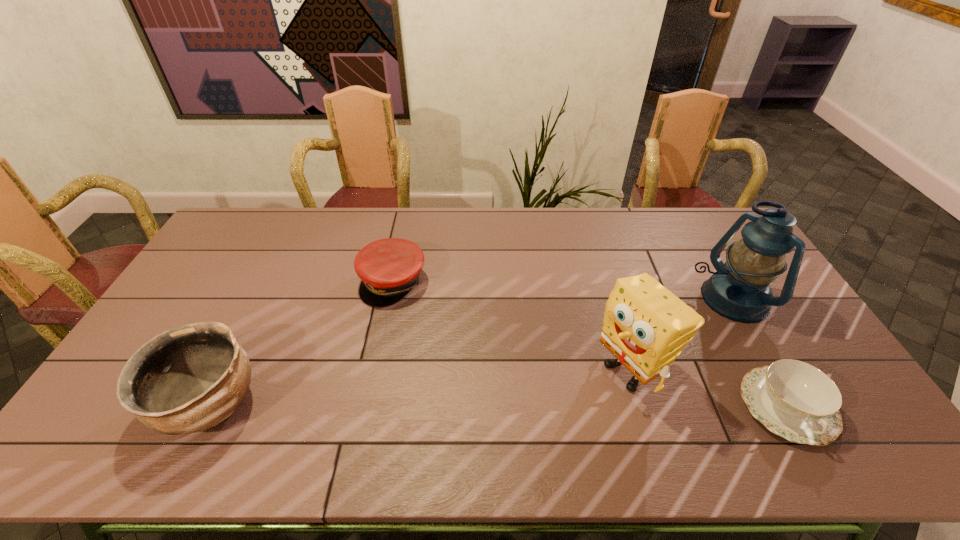
Identify the location of the leftmost object. (187, 379).

In order to click on the third tallest object in this screenshot , I will do `click(187, 379)`.

At what (x,y) coordinates should I click in order to perform the action: click on chinaware. Please return your answer as a coordinate pair (x, y). Looking at the image, I should click on (795, 400).

Where is `the second shortest object`? This screenshot has height=540, width=960. the second shortest object is located at coordinates (389, 268).

In order to click on cap in this screenshot , I will do `click(389, 268)`.

Identify the location of the third object from right to left. The width and height of the screenshot is (960, 540). (645, 326).

This screenshot has height=540, width=960. Identify the location of the second tallest object. (645, 326).

Where is `lantern`? This screenshot has height=540, width=960. lantern is located at coordinates (739, 290).

Identify the location of vacant space located 0.380m on the right of the pottery. The height and width of the screenshot is (540, 960). (410, 404).

This screenshot has height=540, width=960. In order to click on vacant space located 0.210m on the front-facing side of the second shortest object in this screenshot , I will do `click(420, 357)`.